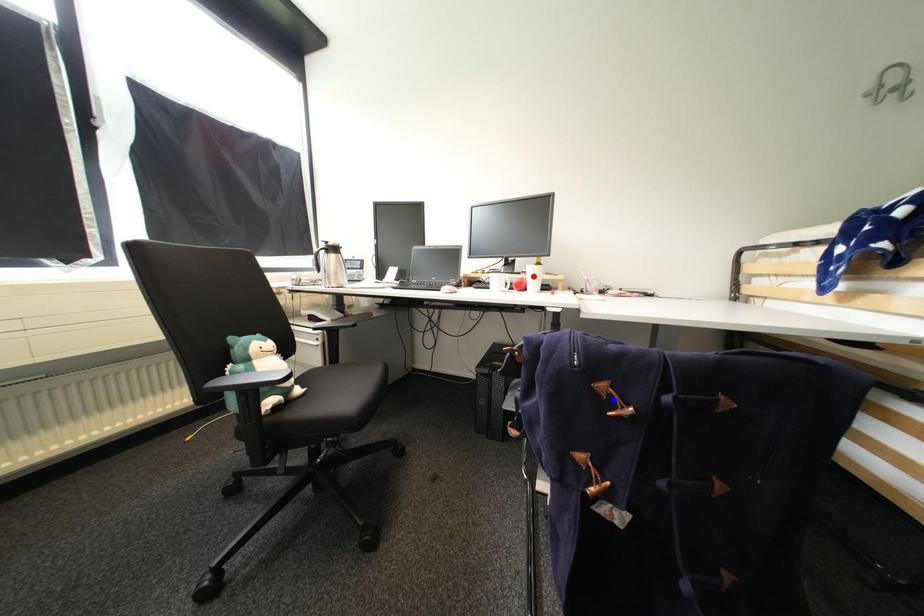
Question: Two points are marked on the image. Which point is closer to the camera?

Choices:
 (A) Blue point is closer.
 (B) Red point is closer.

Answer: (A)